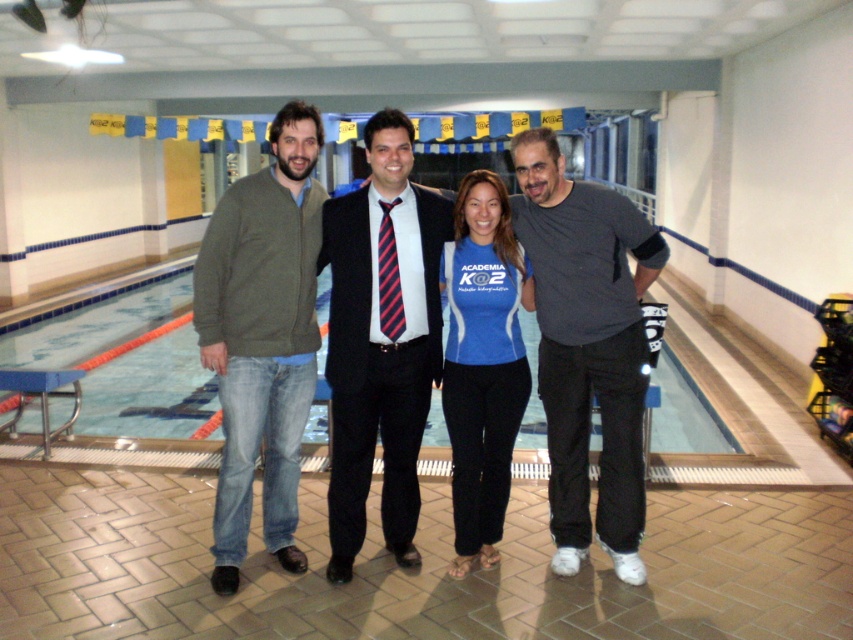
You are a photographer trying to capture a photo of the group. The green sweater at left and the black suit at center are two key elements in the frame. Based on their positions, which one is closer to the camera?

The green sweater at left is located above the black suit at center, which suggests it is closer to the camera.

You are standing in the gymnasium near the swimming pool and see the dark gray sweatshirt at right. Where exactly is it positioned in the image?

The dark gray sweatshirt at right is located at point 0.544 on the horizontal axis and 0.689 on the vertical axis within the image coordinates.

From the picture: You are standing in a gymnasium with a swimming pool and exercise equipment. You see a green sweater at left and a black suit at center. Which person is positioned more to the left side of the group?

The green sweater at left is positioned more to the left side of the group than the black suit at center.